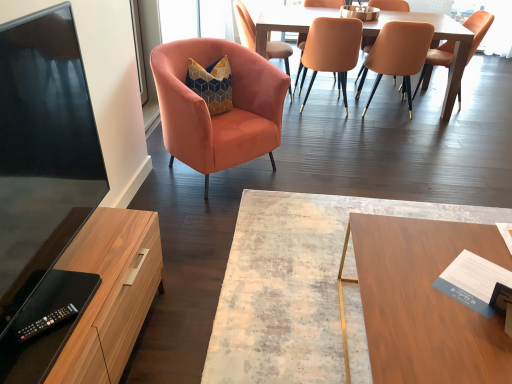
Identify the location of vacant space in front of light brown wooden table at center. (380, 148).